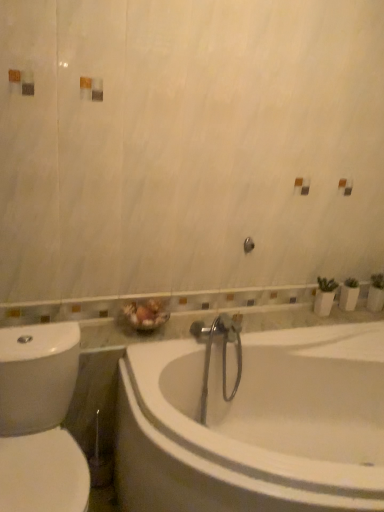
In the scene shown: What is the approximate width of white glossy bathtub at center?

97.12 centimeters.

Measure the distance between white glossy bathtub at center and camera.

1.13 meters.

This screenshot has width=384, height=512. What do you see at coordinates (255, 424) in the screenshot?
I see `white glossy bathtub at center` at bounding box center [255, 424].

Image resolution: width=384 pixels, height=512 pixels. I want to click on white glossy bathtub at center, so click(x=255, y=424).

Image resolution: width=384 pixels, height=512 pixels. I want to click on white glossy toilet at left, so tap(40, 420).

Describe the element at coordinates (40, 420) in the screenshot. This screenshot has width=384, height=512. I see `white glossy toilet at left` at that location.

I want to click on white glossy bathtub at center, so click(x=255, y=424).

Considering the relative positions of white glossy bathtub at center and white glossy toilet at left in the image provided, is white glossy bathtub at center to the left or to the right of white glossy toilet at left?

From the image, it's evident that white glossy bathtub at center is to the right of white glossy toilet at left.

Considering the relative positions of white glossy bathtub at center and white glossy toilet at left in the image provided, is white glossy bathtub at center in front of white glossy toilet at left?

Yes, it is in front of white glossy toilet at left.

Does point (213, 500) appear closer or farther from the camera than point (56, 459)?

Point (213, 500) appears to be closer to the viewer than point (56, 459).

From the image's perspective, is white glossy bathtub at center above white glossy toilet at left?

No.

From a real-world perspective, which object stands above the other?

white glossy toilet at left is physically above.

Can you confirm if white glossy bathtub at center is wider than white glossy toilet at left?

Correct, the width of white glossy bathtub at center exceeds that of white glossy toilet at left.

In the scene shown: Between white glossy bathtub at center and white glossy toilet at left, which one has more height?

white glossy toilet at left is taller.

Between white glossy bathtub at center and white glossy toilet at left, which one has smaller size?

With smaller size is white glossy toilet at left.

Is white glossy toilet at left completely or partially inside white glossy bathtub at center?

That's incorrect, white glossy toilet at left is not inside white glossy bathtub at center.

Is white glossy bathtub at center far away from white glossy toilet at left?

white glossy bathtub at center is near white glossy toilet at left, not far away.

Is white glossy toilet at left at the back of white glossy bathtub at center?

No, white glossy toilet at left is not at the back of white glossy bathtub at center.

At what (x,y) coordinates should I click in order to perform the action: click on bathtub located underneath the white glossy toilet at left (from a real-world perspective). Please return your answer as a coordinate pair (x, y). Looking at the image, I should click on [255, 424].

Would you say white glossy toilet at left is to the left or to the right of white glossy bathtub at center in the picture?

white glossy toilet at left is positioned on white glossy bathtub at center's left side.

Between white glossy toilet at left and white glossy bathtub at center, which one is positioned behind?

Positioned behind is white glossy toilet at left.

Does point (45, 360) come behind point (379, 419)?

No, it is not.

From the image's perspective, relative to white glossy bathtub at center, is white glossy toilet at left above or below?

From the image's perspective, white glossy toilet at left appears above white glossy bathtub at center.

From a real-world perspective, is white glossy toilet at left beneath white glossy bathtub at center?

No, from a real-world perspective, white glossy toilet at left is not below white glossy bathtub at center.

Considering the relative sizes of white glossy toilet at left and white glossy bathtub at center in the image provided, is white glossy toilet at left wider than white glossy bathtub at center?

No.

Considering the relative sizes of white glossy toilet at left and white glossy bathtub at center in the image provided, is white glossy toilet at left shorter than white glossy bathtub at center?

Incorrect, the height of white glossy toilet at left does not fall short of that of white glossy bathtub at center.

Which of these two, white glossy toilet at left or white glossy bathtub at center, is bigger?

With larger size is white glossy bathtub at center.

Could white glossy bathtub at center be considered to be inside white glossy toilet at left?

No, white glossy bathtub at center is located outside of white glossy toilet at left.

Are white glossy toilet at left and white glossy bathtub at center making contact?

white glossy toilet at left and white glossy bathtub at center are clearly separated.

Is white glossy bathtub at center at the back of white glossy toilet at left?

No, white glossy bathtub at center is not at the back of white glossy toilet at left.

How many degrees apart are the facing directions of white glossy toilet at left and white glossy bathtub at center?

white glossy toilet at left and white glossy bathtub at center are facing 0.364 degrees away from each other.

How distant is white glossy toilet at left from white glossy bathtub at center?

The distance of white glossy toilet at left from white glossy bathtub at center is 20.16 inches.

Locate an element on the screen. toilet located behind the white glossy bathtub at center is located at coordinates (40, 420).

I want to click on bathtub beneath the white glossy toilet at left (from a real-world perspective), so click(x=255, y=424).

Find the location of a particular element. Image resolution: width=384 pixels, height=512 pixels. toilet on the left of white glossy bathtub at center is located at coordinates (40, 420).